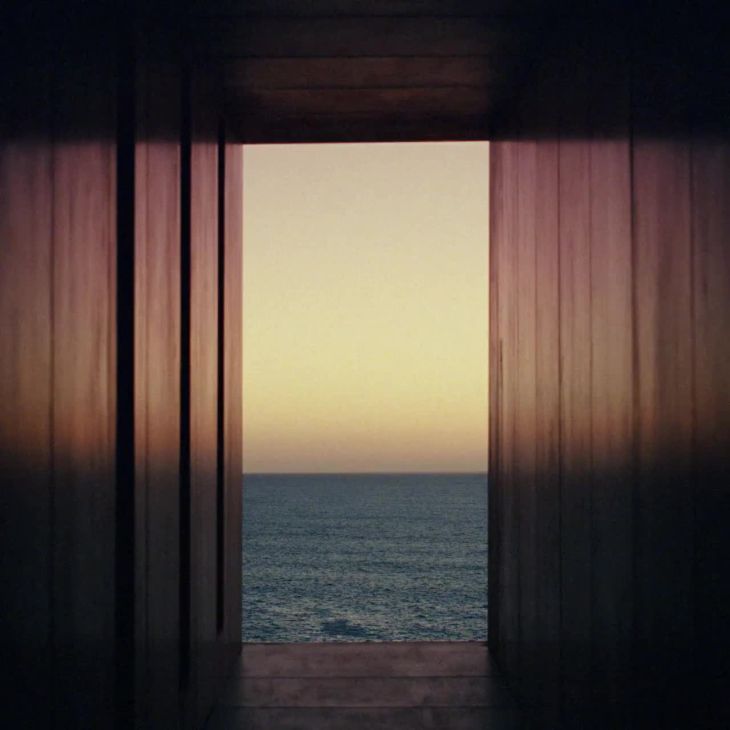
Locate an element on the screen. Image resolution: width=730 pixels, height=730 pixels. sections in floor is located at coordinates (387, 707), (385, 672).